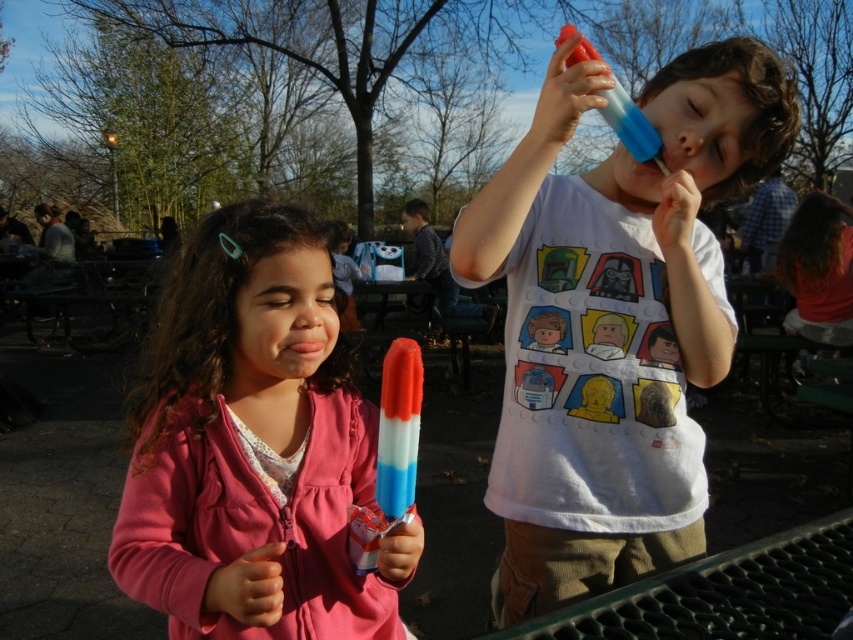
Looking at this image, you are a photographer trying to capture a candid shot of the two children in the park scene. You notice the white cotton shirt at center and the smooth skin nose at center. Which object would appear bigger in your photo?

The white cotton shirt at center appears bigger in the photo than the smooth skin nose at center because it has a larger size.